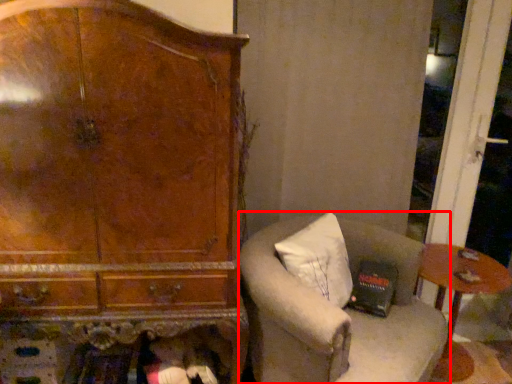
Question: From the image's perspective, considering the relative positions of chair (annotated by the red box) and table in the image provided, where is chair (annotated by the red box) located with respect to the staircase?

Choices:
 (A) below
 (B) above

Answer: (B)